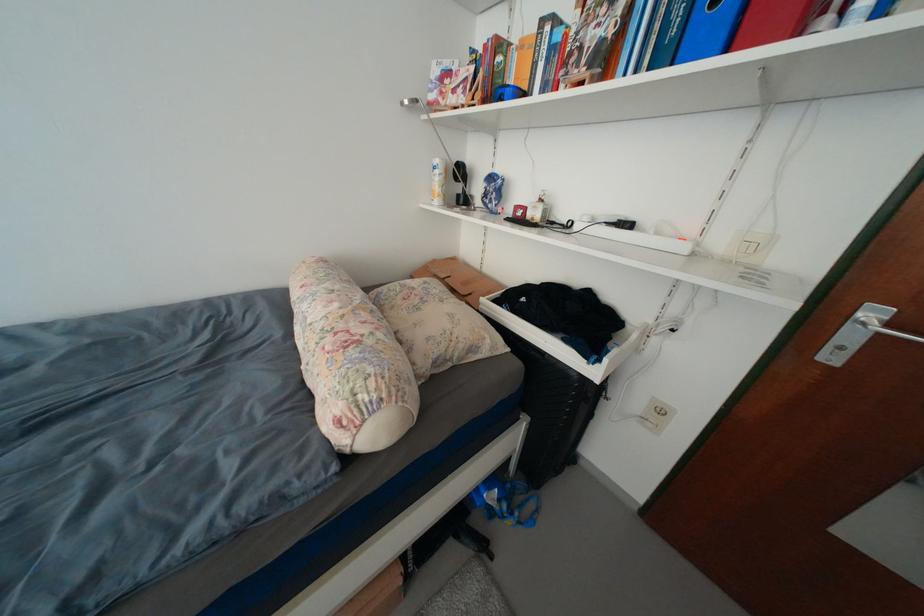
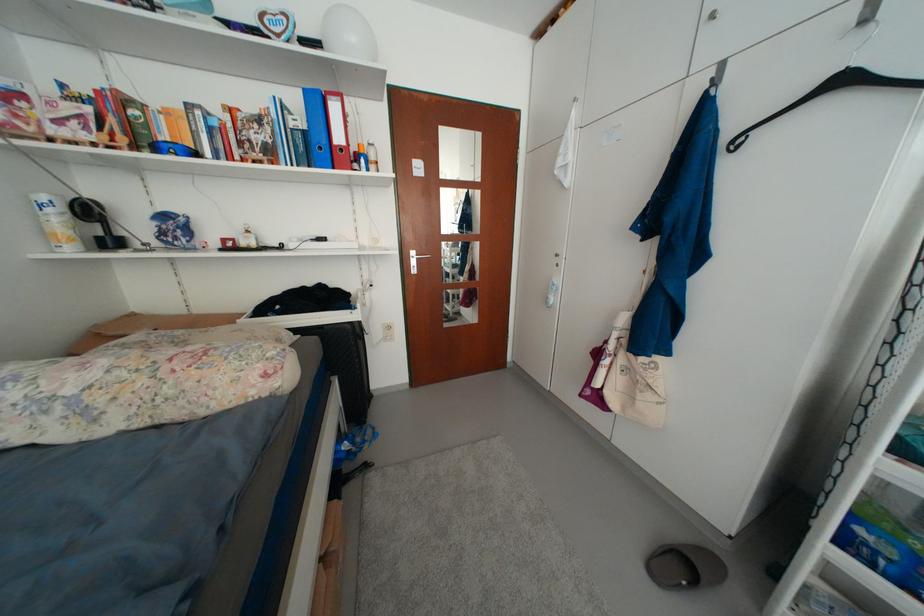
Question: How did the camera likely rotate?

Choices:
 (A) Left
 (B) Right
 (C) Up
 (D) Down

Answer: (B)